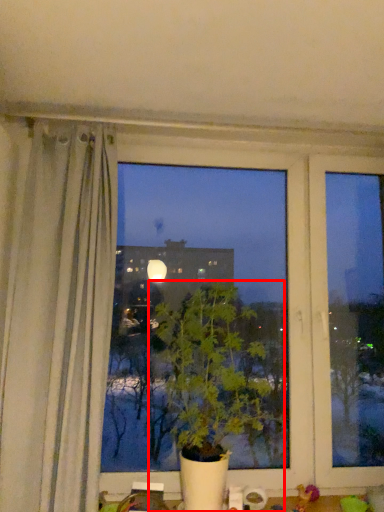
Question: From the image, what is the correct spatial relationship of houseplant (annotated by the red box) in relation to toy?

Choices:
 (A) left
 (B) right

Answer: (A)